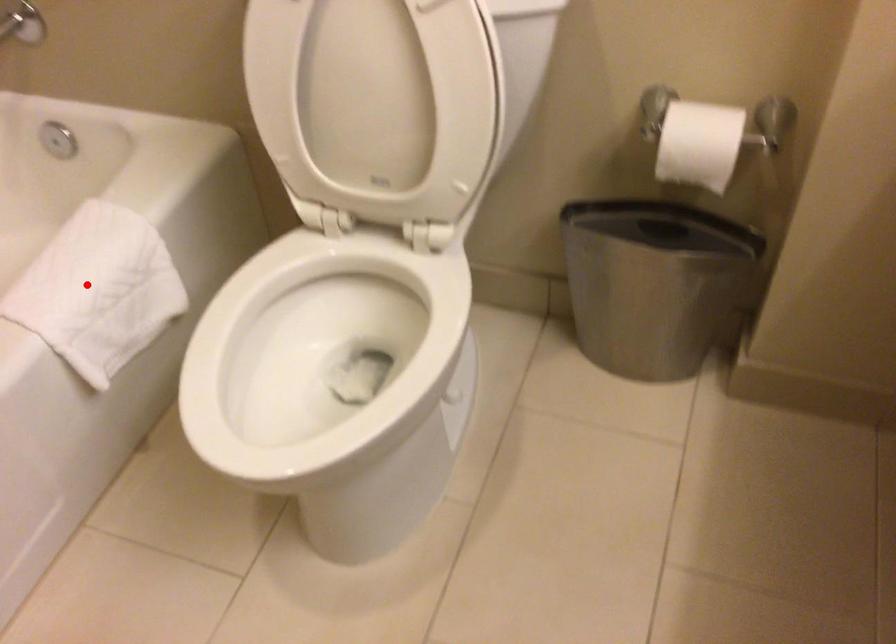
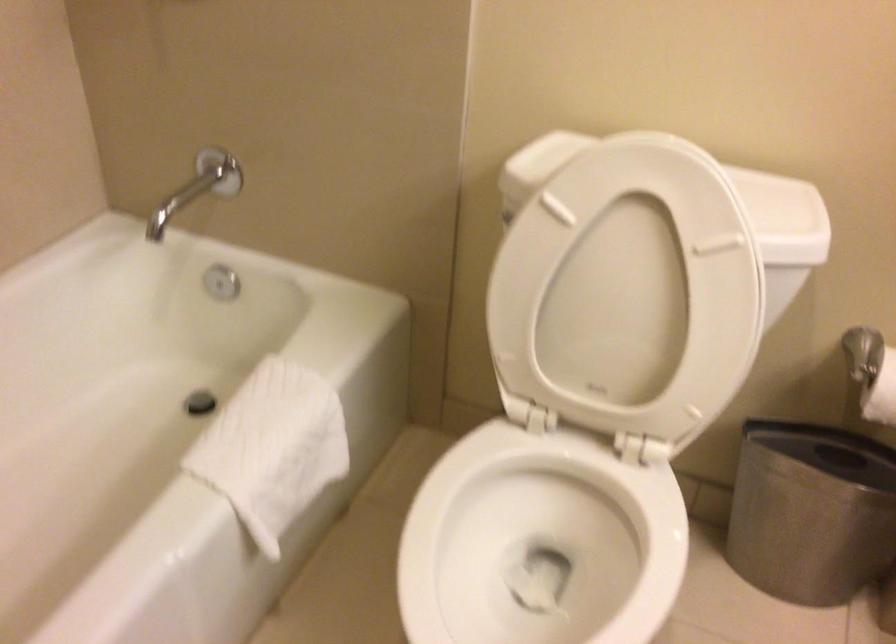
The point at the highlighted location is marked in the first image. Where is the corresponding point in the second image?

(272, 448)